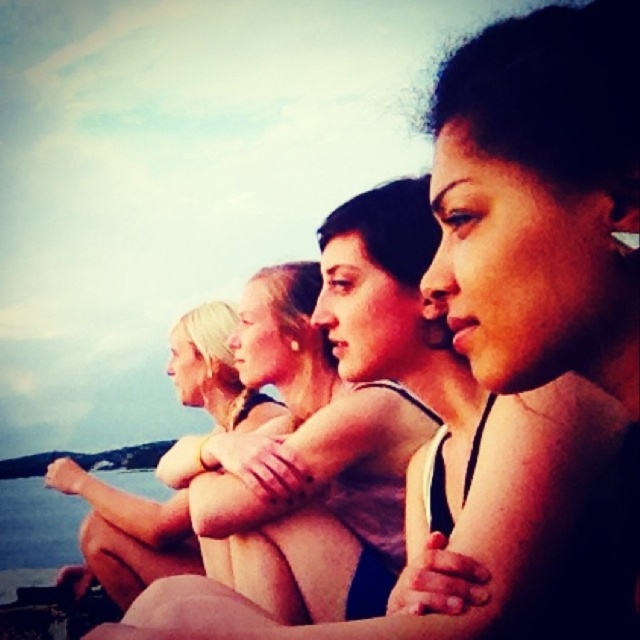
Is blonde hair at center bigger than transparent water at lower left?

Actually, blonde hair at center might be smaller than transparent water at lower left.

Does blonde hair at center appear on the left side of transparent water at lower left?

Incorrect, blonde hair at center is not on the left side of transparent water at lower left.

Who is more distant from viewer, [138,564] or [77,557]?

The point [77,557] is more distant.

Locate an element on the screen. The height and width of the screenshot is (640, 640). blonde hair at center is located at coordinates 134,534.